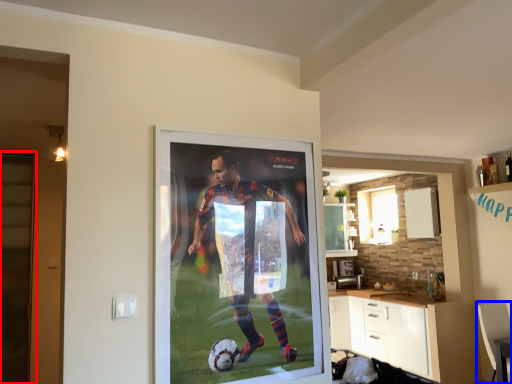
Question: Which object is closer to the camera taking this photo, screen door (highlighted by a red box) or armchair (highlighted by a blue box)?

Choices:
 (A) screen door
 (B) armchair

Answer: (A)